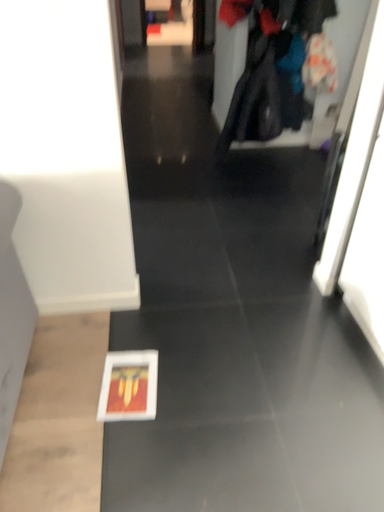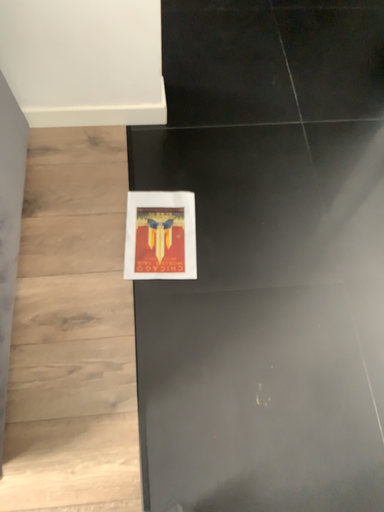
Question: How did the camera likely rotate when shooting the video?

Choices:
 (A) rotated upward
 (B) rotated downward

Answer: (B)